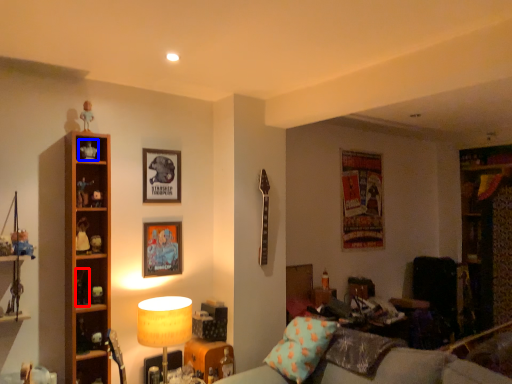
Question: Which object appears farthest to the camera in this image, toy (highlighted by a red box) or toy (highlighted by a blue box)?

Choices:
 (A) toy
 (B) toy

Answer: (B)